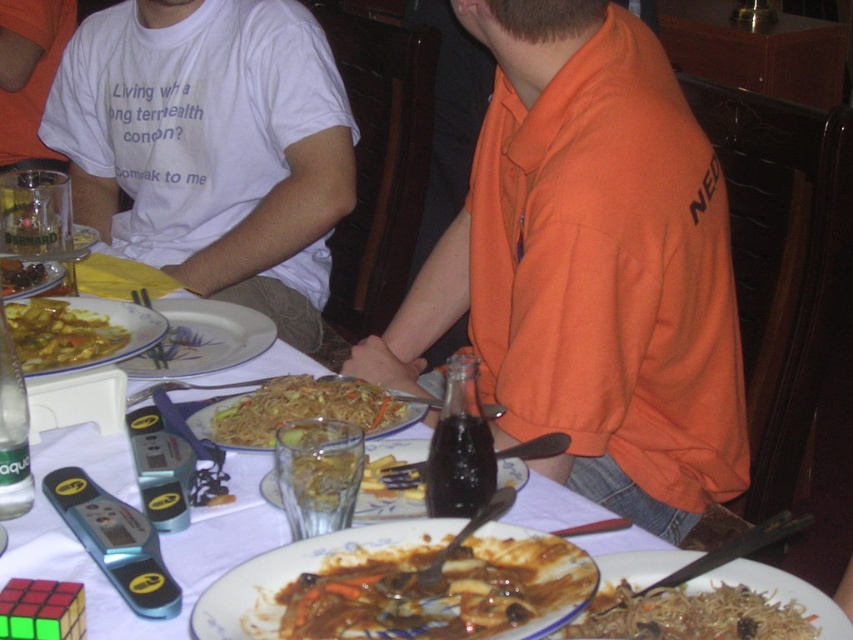
You are a waiter trying to clear the dishes from the table. You see the white glossy plate at upper center and the brown glossy meat at center. Which item should you move first to efficiently clear the table?

The white glossy plate at upper center should be moved first because the brown glossy meat at center is behind it, making it easier to access the plate first before reaching the meat.

You are sitting at the table and want to reach for the two points on the table. Which point, point (366, 488) or point (91, 244), is closer to you?

Point (366, 488) is closer to the viewer than point (91, 244).